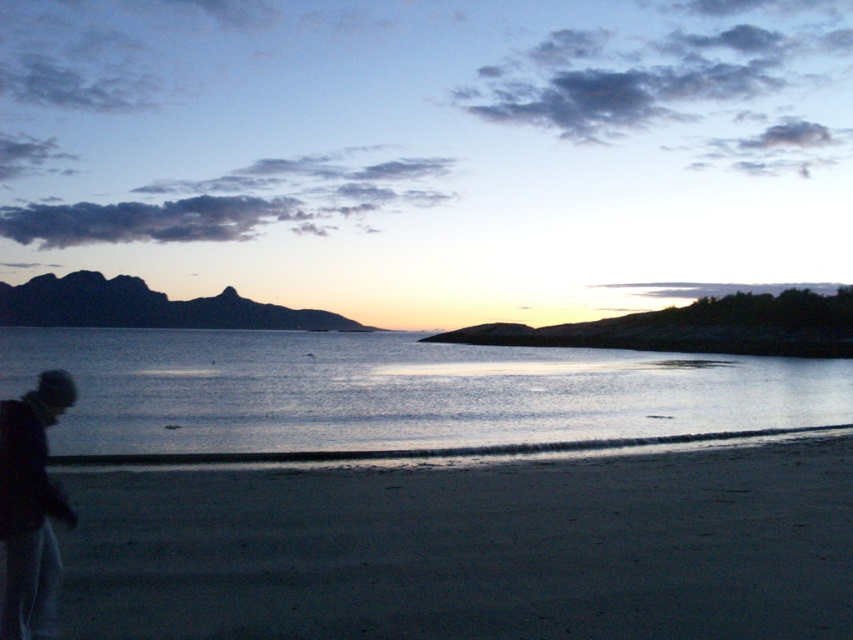
You are standing on the beach looking out at the water. You see dark sand at lower left and glistening water at center. Which object is positioned to the right of the other?

The dark sand at lower left is to the right of glistening water at center.